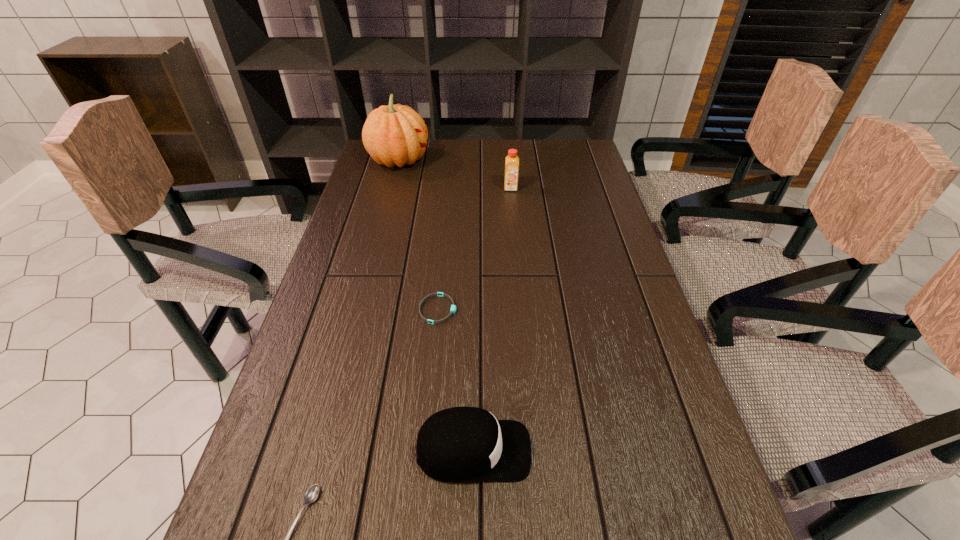
The height and width of the screenshot is (540, 960). I want to click on free spot located 0.060m on the front-facing side of the third shortest object, so click(x=563, y=451).

At what (x,y) coordinates should I click in order to perform the action: click on free spot located 0.220m on the buckle of the second shortest object. Please return your answer as a coordinate pair (x, y). Looking at the image, I should click on (546, 309).

This screenshot has height=540, width=960. What are the coordinates of `object that is at the far edge` in the screenshot? It's located at (393, 135).

The height and width of the screenshot is (540, 960). Find the location of `object present at the left edge`. object present at the left edge is located at coordinates (393, 135).

Find the location of a particular element. The height and width of the screenshot is (540, 960). object that is at the far left corner is located at coordinates (393, 135).

At what (x,y) coordinates should I click in order to perform the action: click on vacant space at the far edge of the desktop. Please return your answer as a coordinate pair (x, y). Image resolution: width=960 pixels, height=540 pixels. Looking at the image, I should click on (461, 154).

Find the location of a particular element. vacant space at the left edge of the desktop is located at coordinates (399, 177).

Where is `free space at the right edge`? This screenshot has width=960, height=540. free space at the right edge is located at coordinates (635, 364).

Where is `blank area at the far left corner`? The width and height of the screenshot is (960, 540). blank area at the far left corner is located at coordinates (370, 168).

Where is `vacant region at the far right corner of the desktop`? This screenshot has height=540, width=960. vacant region at the far right corner of the desktop is located at coordinates (566, 148).